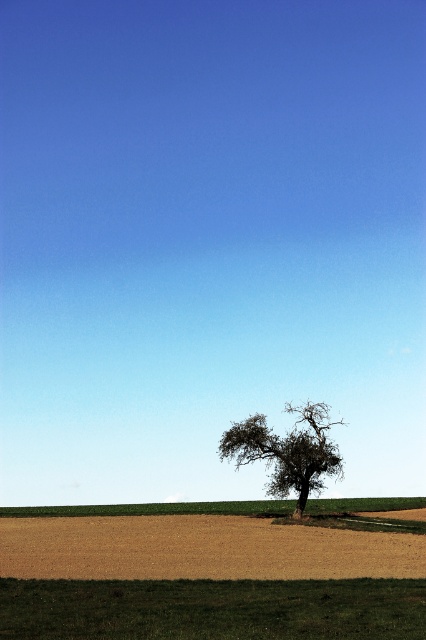
Question: Is brown matte wheat field at lower center above dark green textured tree at center?

Choices:
 (A) no
 (B) yes

Answer: (A)

Question: Is brown matte wheat field at lower center wider than dark green textured tree at center?

Choices:
 (A) no
 (B) yes

Answer: (B)

Question: Can you confirm if brown matte wheat field at lower center is bigger than dark green textured tree at center?

Choices:
 (A) yes
 (B) no

Answer: (A)